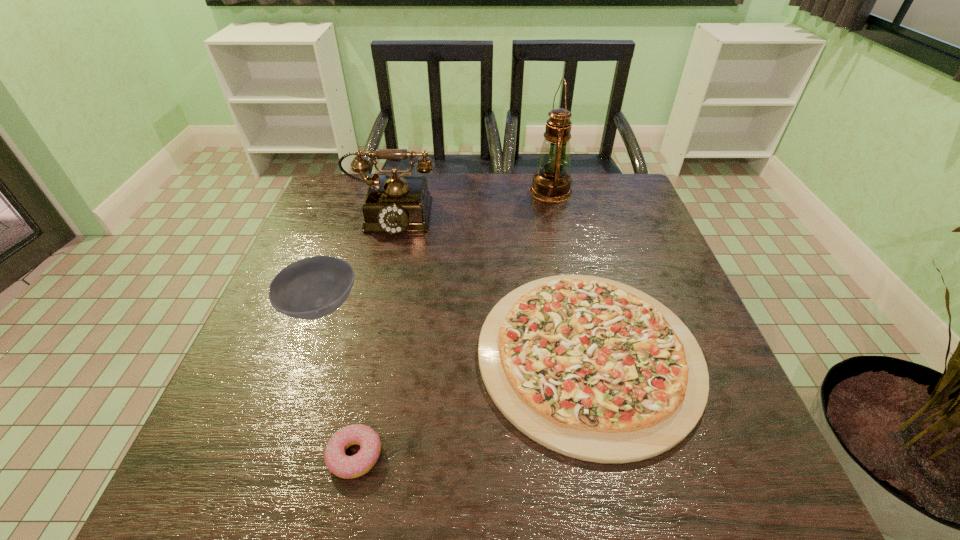
Find the location of a particular element. The height and width of the screenshot is (540, 960). oil lamp at the far edge is located at coordinates (551, 183).

Where is `telephone situated at the far edge`? This screenshot has height=540, width=960. telephone situated at the far edge is located at coordinates (394, 203).

Where is `pizza that is at the near edge`? Image resolution: width=960 pixels, height=540 pixels. pizza that is at the near edge is located at coordinates (591, 368).

Find the location of a particular element. doughnut positioned at the near edge is located at coordinates (347, 467).

I want to click on telephone located in the left edge section of the desktop, so click(394, 203).

Where is `bowl situated at the left edge`? The height and width of the screenshot is (540, 960). bowl situated at the left edge is located at coordinates (311, 288).

You are a GUI agent. You are given a task and a screenshot of the screen. Output one action in this format:
    pyautogui.click(x=<x>, y=<y>)
    Task: Click on the object positioned at the right edge
    
    Given the screenshot: What is the action you would take?
    pyautogui.click(x=591, y=368)

Where is `object that is at the far left corner`? object that is at the far left corner is located at coordinates (394, 203).

Where is `object at the near right corner`? The height and width of the screenshot is (540, 960). object at the near right corner is located at coordinates (591, 368).

In order to click on vacant space at the far edge of the desktop in this screenshot , I will do `click(478, 218)`.